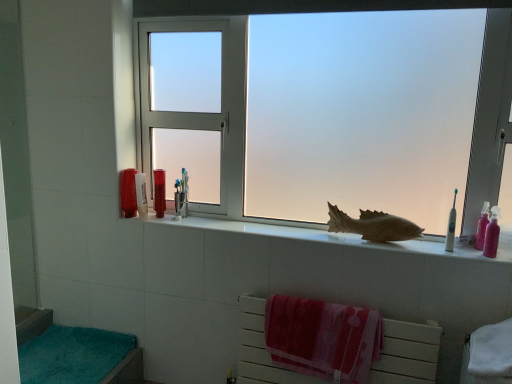
Image resolution: width=512 pixels, height=384 pixels. What are the coordinates of `vacant area to the left of white plastic toothbrush at right` in the screenshot? It's located at (413, 243).